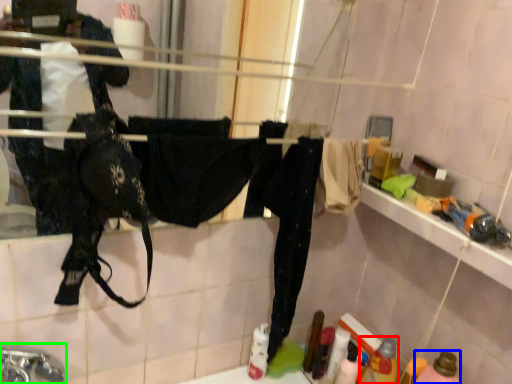
Question: Which object is positioned closest to bottle (highlighted by a red box)? Select from bottle (highlighted by a blue box) and faucet (highlighted by a green box).

Choices:
 (A) bottle
 (B) faucet

Answer: (A)